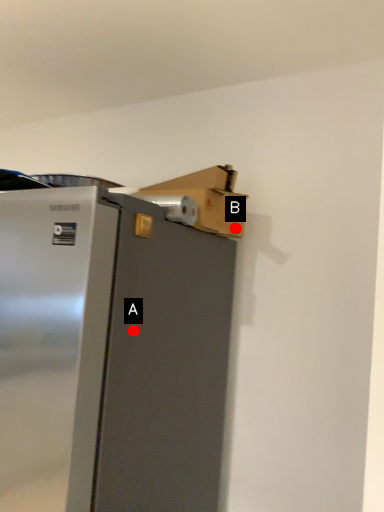
Question: Two points are circled on the image, labeled by A and B beside each circle. Which point is farther from the camera taking this photo?

Choices:
 (A) A is further
 (B) B is further

Answer: (B)